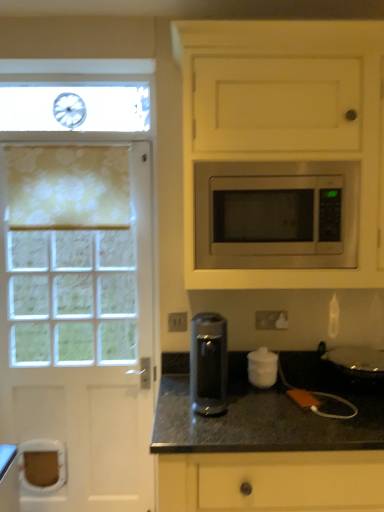
Question: From a real-world perspective, is granite/black at lower center positioned above or below satin silver microwave at upper right?

Choices:
 (A) below
 (B) above

Answer: (A)

Question: Considering the positions of point (382, 393) and point (273, 210), is point (382, 393) closer or farther from the camera than point (273, 210)?

Choices:
 (A) farther
 (B) closer

Answer: (A)

Question: Which object is positioned farthest from the granite/black at lower center?

Choices:
 (A) satin white microwave at upper center
 (B) yellow floral fabric at left
 (C) white textured door at left
 (D) satin silver microwave at upper right
 (E) sleek metallic coffee maker at center

Answer: (B)

Question: Considering the real-world distances, which object is closest to the sleek metallic coffee maker at center?

Choices:
 (A) granite/black at lower center
 (B) yellow floral fabric at left
 (C) white textured door at left
 (D) satin white microwave at upper center
 (E) white matte sugar container at center

Answer: (E)